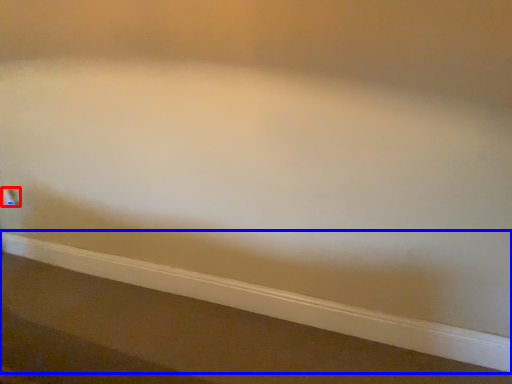
Question: Which point is closer to the camera, electric outlet (highlighted by a red box) or ledge (highlighted by a blue box)?

Choices:
 (A) electric outlet
 (B) ledge

Answer: (B)